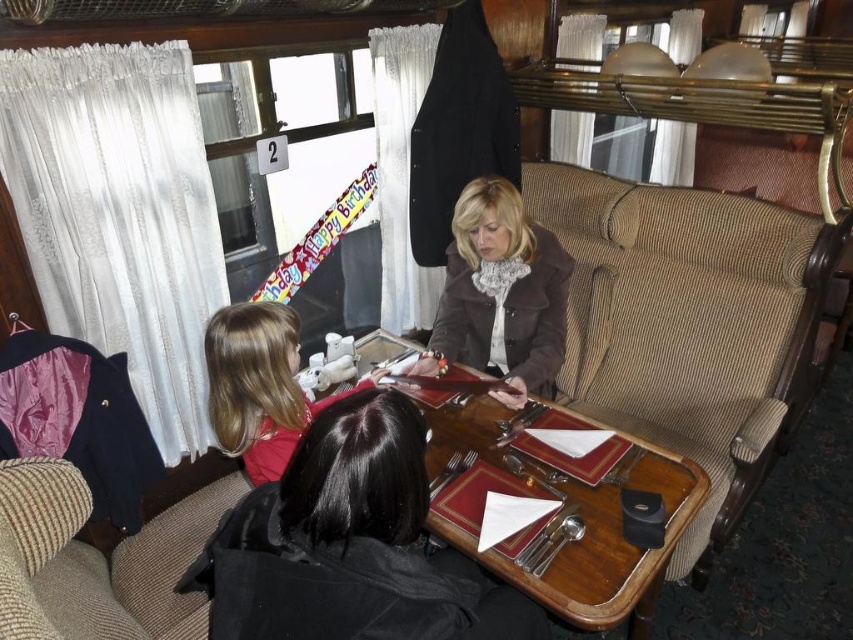
Who is more distant from viewer, (675, 436) or (521, 540)?

Point (675, 436)

Can you confirm if beige corduroy armchair at right is positioned to the right of wooden table at center?

Correct, you'll find beige corduroy armchair at right to the right of wooden table at center.

Identify the location of beige corduroy armchair at right. The image size is (853, 640). (688, 321).

Identify the location of beige corduroy armchair at right. This screenshot has height=640, width=853. (688, 321).

From the picture: Does matte brown jacket at center have a smaller size compared to blonde hair at center?

No, matte brown jacket at center is not smaller than blonde hair at center.

Is matte brown jacket at center bigger than blonde hair at center?

Correct, matte brown jacket at center is larger in size than blonde hair at center.

Locate an element on the screen. The image size is (853, 640). matte brown jacket at center is located at coordinates (500, 294).

Is wooden table at center thinner than matte brown jacket at center?

No, wooden table at center is not thinner than matte brown jacket at center.

Does wooden table at center appear over matte brown jacket at center?

No, wooden table at center is not above matte brown jacket at center.

Is point (576, 541) closer to camera compared to point (479, 200)?

Yes, it is in front of point (479, 200).

Identify the location of wooden table at center. The height and width of the screenshot is (640, 853). (566, 513).